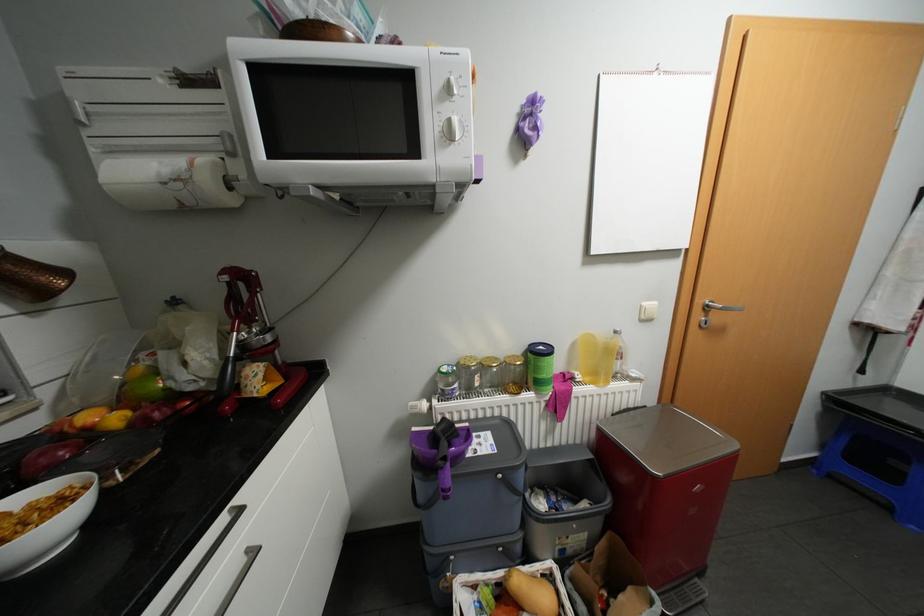
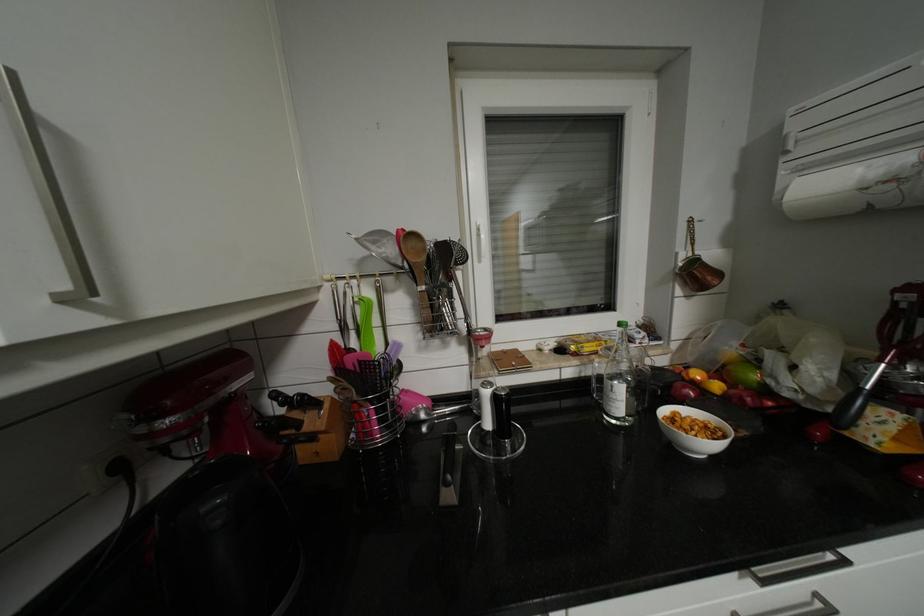
In the second image, find the point that corresponds to (188,184) in the first image.

(898, 185)